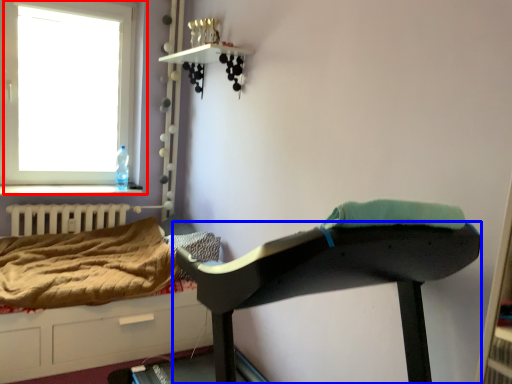
Question: Which of the following is the farthest to the observer, window (highlighted by a red box) or furniture (highlighted by a blue box)?

Choices:
 (A) window
 (B) furniture

Answer: (A)